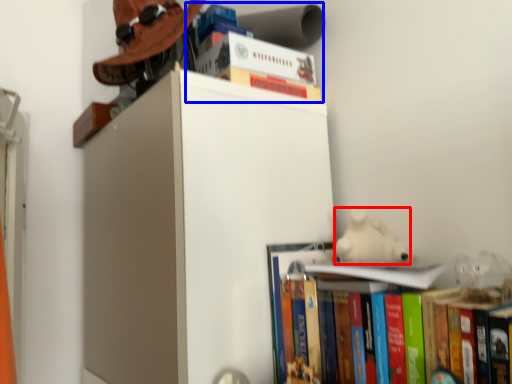
Question: Which of the following is the farthest to the observer, animal (highlighted by a red box) or book (highlighted by a blue box)?

Choices:
 (A) animal
 (B) book

Answer: (B)